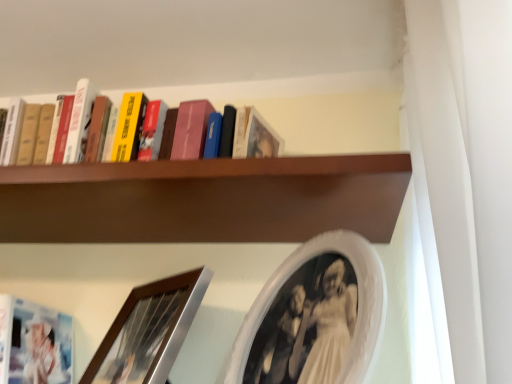
This screenshot has width=512, height=384. What do you see at coordinates (149, 331) in the screenshot?
I see `brushed silver picture frame at lower left, which is the 2th picture frame in right-to-left order` at bounding box center [149, 331].

The height and width of the screenshot is (384, 512). What do you see at coordinates (314, 316) in the screenshot? I see `white oval picture frame at upper center, which is the 2th picture frame in left-to-right order` at bounding box center [314, 316].

Where is `brushed silver picture frame at lower left, positioned as the first picture frame in left-to-right order`? The image size is (512, 384). brushed silver picture frame at lower left, positioned as the first picture frame in left-to-right order is located at coordinates (149, 331).

In the scene shown: Is white oval picture frame at upper center, which is counted as the first picture frame, starting from the right, facing towards brushed silver picture frame at lower left, which is the 2th picture frame in right-to-left order?

No, white oval picture frame at upper center, which is counted as the first picture frame, starting from the right, is not oriented towards brushed silver picture frame at lower left, which is the 2th picture frame in right-to-left order.

Based on the photo, considering the relative sizes of white oval picture frame at upper center, which is counted as the first picture frame, starting from the right, and brushed silver picture frame at lower left, positioned as the first picture frame in left-to-right order, in the image provided, is white oval picture frame at upper center, which is counted as the first picture frame, starting from the right, smaller than brushed silver picture frame at lower left, positioned as the first picture frame in left-to-right order,?

Incorrect, white oval picture frame at upper center, which is counted as the first picture frame, starting from the right, is not smaller in size than brushed silver picture frame at lower left, positioned as the first picture frame in left-to-right order.

You are a GUI agent. You are given a task and a screenshot of the screen. Output one action in this format:
    pyautogui.click(x=<x>, y=<y>)
    Task: Click on the picture frame beneath the white oval picture frame at upper center, which is the 2th picture frame in left-to-right order (from a real-world perspective)
    The height and width of the screenshot is (384, 512).
    Given the screenshot: What is the action you would take?
    pyautogui.click(x=149, y=331)

Which of these two, white oval picture frame at upper center, which is counted as the first picture frame, starting from the right, or brushed silver picture frame at lower left, which is the 2th picture frame in right-to-left order, stands taller?

Standing taller between the two is white oval picture frame at upper center, which is counted as the first picture frame, starting from the right.

From the picture: Considering the sizes of brushed silver picture frame at lower left, which is the 2th picture frame in right-to-left order, and white oval picture frame at upper center, which is counted as the first picture frame, starting from the right, in the image, is brushed silver picture frame at lower left, which is the 2th picture frame in right-to-left order, taller or shorter than white oval picture frame at upper center, which is counted as the first picture frame, starting from the right,?

brushed silver picture frame at lower left, which is the 2th picture frame in right-to-left order, is shorter than white oval picture frame at upper center, which is counted as the first picture frame, starting from the right.

Considering the sizes of objects brushed silver picture frame at lower left, which is the 2th picture frame in right-to-left order, and white oval picture frame at upper center, which is the 2th picture frame in left-to-right order, in the image provided, who is thinner, brushed silver picture frame at lower left, which is the 2th picture frame in right-to-left order, or white oval picture frame at upper center, which is the 2th picture frame in left-to-right order,?

brushed silver picture frame at lower left, which is the 2th picture frame in right-to-left order, is thinner.

Where is `picture frame below the white oval picture frame at upper center, which is counted as the first picture frame, starting from the right (from a real-world perspective)`? The width and height of the screenshot is (512, 384). picture frame below the white oval picture frame at upper center, which is counted as the first picture frame, starting from the right (from a real-world perspective) is located at coordinates (149, 331).

Which point is more forward, (x=296, y=209) or (x=270, y=359)?

The point (x=270, y=359) is closer.

In the scene shown: Which is behind, brown wooden shelf at upper center or white oval picture frame at upper center, which is the 2th picture frame in left-to-right order?

brown wooden shelf at upper center is behind.

Can you confirm if brown wooden shelf at upper center is taller than white oval picture frame at upper center, which is the 2th picture frame in left-to-right order?

No.

Are brushed silver picture frame at lower left, which is the 2th picture frame in right-to-left order, and brown wooden shelf at upper center far apart?

brushed silver picture frame at lower left, which is the 2th picture frame in right-to-left order, is near brown wooden shelf at upper center, not far away.

Which is closer to the camera, (x=177, y=312) or (x=341, y=182)?

Clearly, point (x=177, y=312) is more distant from the camera than point (x=341, y=182).

Is brushed silver picture frame at lower left, positioned as the first picture frame in left-to-right order, facing away from brown wooden shelf at upper center?

No, brushed silver picture frame at lower left, positioned as the first picture frame in left-to-right order,'s orientation is not away from brown wooden shelf at upper center.

From the image's perspective, would you say brushed silver picture frame at lower left, positioned as the first picture frame in left-to-right order, is positioned over brown wooden shelf at upper center?

No, from the image's perspective, brushed silver picture frame at lower left, positioned as the first picture frame in left-to-right order, is not above brown wooden shelf at upper center.

From a real-world perspective, between white oval picture frame at upper center, which is the 2th picture frame in left-to-right order, and brown wooden shelf at upper center, who is vertically lower?

white oval picture frame at upper center, which is the 2th picture frame in left-to-right order, is physically lower.

Is there a large distance between white oval picture frame at upper center, which is counted as the first picture frame, starting from the right, and brown wooden shelf at upper center?

They are positioned close to each other.

Can you confirm if white oval picture frame at upper center, which is counted as the first picture frame, starting from the right, is wider than brown wooden shelf at upper center?

No.

Considering the sizes of white oval picture frame at upper center, which is the 2th picture frame in left-to-right order, and brown wooden shelf at upper center in the image, is white oval picture frame at upper center, which is the 2th picture frame in left-to-right order, bigger or smaller than brown wooden shelf at upper center?

Clearly, white oval picture frame at upper center, which is the 2th picture frame in left-to-right order, is smaller in size than brown wooden shelf at upper center.

Based on their positions, is brown wooden shelf at upper center located to the left or right of brushed silver picture frame at lower left, positioned as the first picture frame in left-to-right order?

In the image, brown wooden shelf at upper center appears on the right side of brushed silver picture frame at lower left, positioned as the first picture frame in left-to-right order.

Which of these two, brown wooden shelf at upper center or brushed silver picture frame at lower left, positioned as the first picture frame in left-to-right order, is smaller?

Smaller between the two is brushed silver picture frame at lower left, positioned as the first picture frame in left-to-right order.

From a real-world perspective, which object stands above the other?

In real-world perspective, brown wooden shelf at upper center is above.

Find the location of a particular element. This screenshot has width=512, height=384. picture frame to the right of brushed silver picture frame at lower left, which is the 2th picture frame in right-to-left order is located at coordinates (314, 316).

Locate an element on the screen. The image size is (512, 384). picture frame located underneath the white oval picture frame at upper center, which is counted as the first picture frame, starting from the right (from a real-world perspective) is located at coordinates (149, 331).

Based on their spatial positions, is brushed silver picture frame at lower left, which is the 2th picture frame in right-to-left order, or white oval picture frame at upper center, which is the 2th picture frame in left-to-right order, closer to brown wooden shelf at upper center?

Among the two, white oval picture frame at upper center, which is the 2th picture frame in left-to-right order, is located nearer to brown wooden shelf at upper center.

When comparing their distances from brown wooden shelf at upper center, does white oval picture frame at upper center, which is the 2th picture frame in left-to-right order, or brushed silver picture frame at lower left, positioned as the first picture frame in left-to-right order, seem closer?

Among the two, white oval picture frame at upper center, which is the 2th picture frame in left-to-right order, is located nearer to brown wooden shelf at upper center.

Based on their spatial positions, is brushed silver picture frame at lower left, positioned as the first picture frame in left-to-right order, or brown wooden shelf at upper center further from white oval picture frame at upper center, which is counted as the first picture frame, starting from the right?

Among the two, brown wooden shelf at upper center is located further to white oval picture frame at upper center, which is counted as the first picture frame, starting from the right.

Looking at this image, based on their spatial positions, is white oval picture frame at upper center, which is counted as the first picture frame, starting from the right, or brown wooden shelf at upper center further from brushed silver picture frame at lower left, positioned as the first picture frame in left-to-right order?

brown wooden shelf at upper center.

Estimate the real-world distances between objects in this image. Which object is further from brushed silver picture frame at lower left, which is the 2th picture frame in right-to-left order, brown wooden shelf at upper center or white oval picture frame at upper center, which is counted as the first picture frame, starting from the right?

Among the two, brown wooden shelf at upper center is located further to brushed silver picture frame at lower left, which is the 2th picture frame in right-to-left order.

Looking at the image, which one is located further to white oval picture frame at upper center, which is counted as the first picture frame, starting from the right, brown wooden shelf at upper center or brushed silver picture frame at lower left, positioned as the first picture frame in left-to-right order?

brown wooden shelf at upper center is further to white oval picture frame at upper center, which is counted as the first picture frame, starting from the right.

Find the location of a particular element. This screenshot has height=384, width=512. shelf between brushed silver picture frame at lower left, which is the 2th picture frame in right-to-left order, and white oval picture frame at upper center, which is counted as the first picture frame, starting from the right, from left to right is located at coordinates (233, 176).